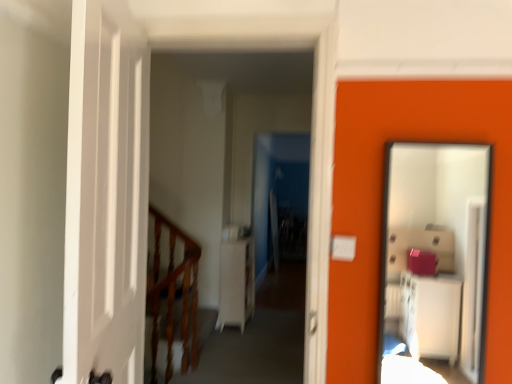
Question: From their relative heights in the image, would you say smooth glass mirror at right is taller or shorter than white matte dresser at center?

Choices:
 (A) short
 (B) tall

Answer: (B)

Question: Would you say smooth glass mirror at right is inside or outside white matte dresser at center?

Choices:
 (A) inside
 (B) outside

Answer: (B)

Question: Based on their relative distances, which object is farther from the white matte dresser at center?

Choices:
 (A) smooth glass mirror at right
 (B) white glossy cabinet at center
 (C) wooden at left

Answer: (A)

Question: Based on their relative distances, which object is farther from the white glossy cabinet at center?

Choices:
 (A) smooth glass mirror at right
 (B) wooden at left
 (C) white matte dresser at center

Answer: (A)